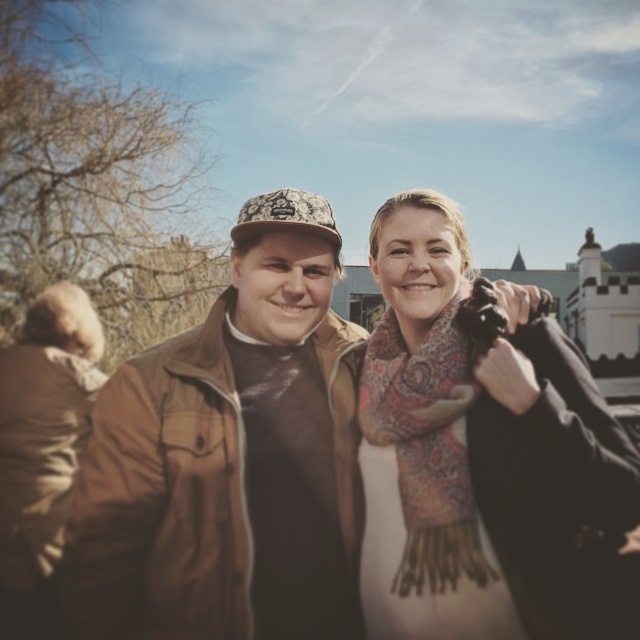
You are a photographer trying to position two markers on a grid overlay for a photo shoot. The markers are placed at point (508, 291) and point (365, 374). Based on the scene, which marker is closer to the camera?

Point (508, 291) is closer to the camera than point (365, 374).

You are trying to describe the clothing details of two people in the image. Which of the two scarves, the patterned scarf at center or the patterned wool scarf at center, is positioned to the right?

The patterned scarf at center is positioned to the right of the patterned wool scarf at center.

You are standing in front of a historical building and want to take a photo of the two people wearing the brown leather jacket at center and the patterned scarf at center. Which object should you focus on first to ensure both are in clear view?

The brown leather jacket at center is closer to you than the patterned scarf at center, so you should focus on the brown leather jacket at center first to ensure both are in clear view.